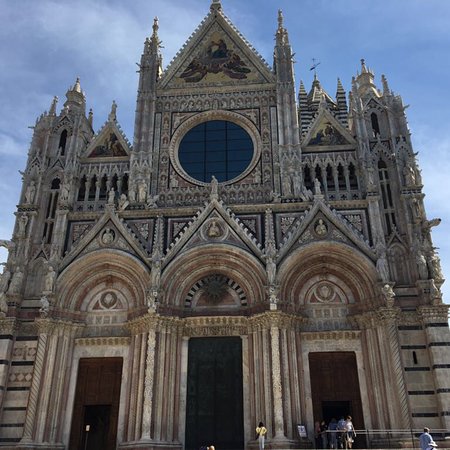
Image resolution: width=450 pixels, height=450 pixels. Find the location of `door`. door is located at coordinates (96, 379), (326, 379).